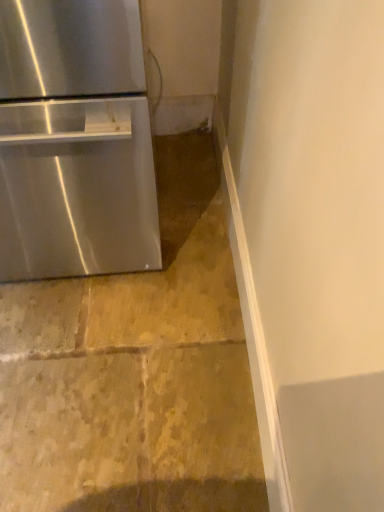
The image size is (384, 512). Find the location of `vacant area on top of stainless steel refrigerator at left (from a real-world perspective)`. vacant area on top of stainless steel refrigerator at left (from a real-world perspective) is located at coordinates (120, 311).